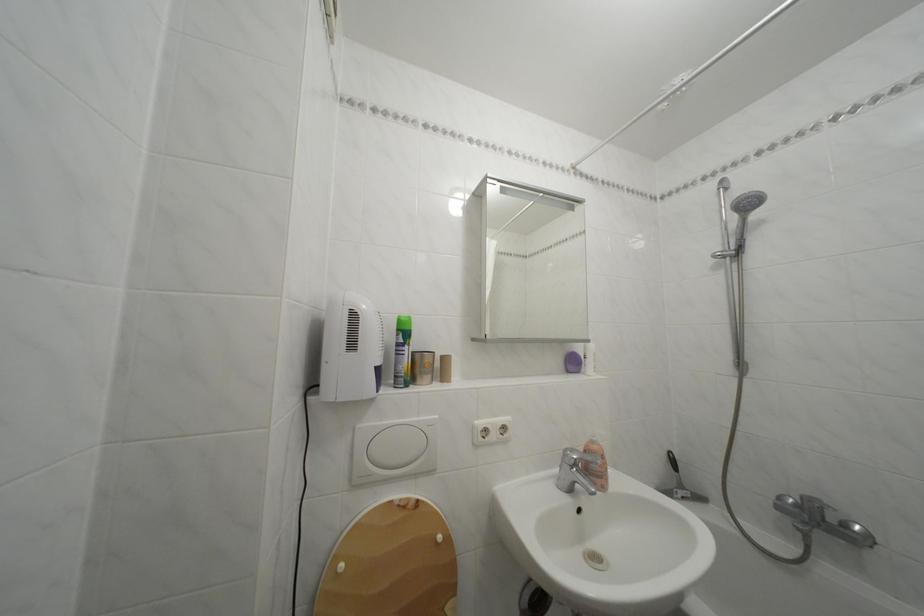
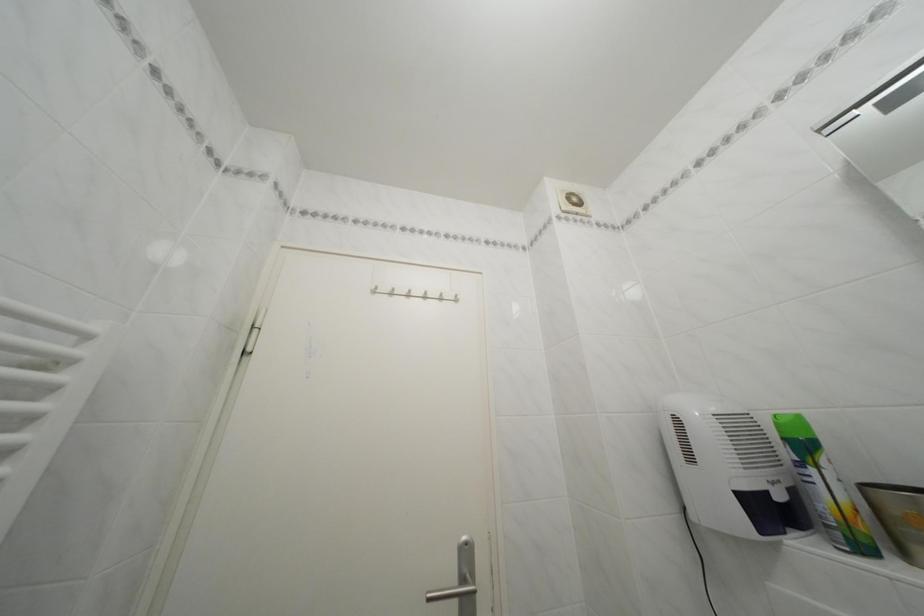
Where in the second image is the point corresponding to (407,336) from the first image?

(793, 445)